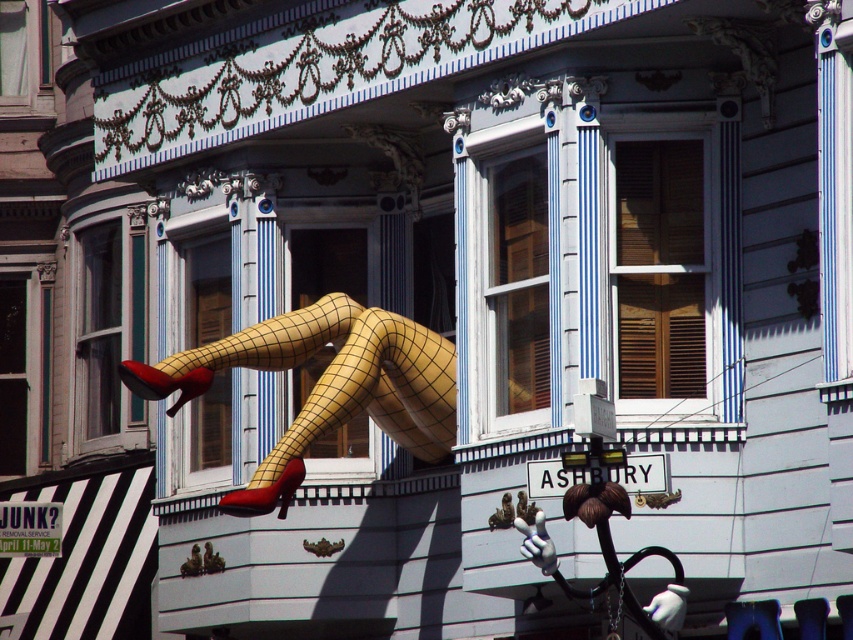
Question: Which point is farther to the camera?

Choices:
 (A) matte yellow shoe at center
 (B) yellow mesh legs at center

Answer: (A)

Question: From the image, what is the correct spatial relationship of yellow mesh legs at center in relation to matte yellow shoe at center?

Choices:
 (A) left
 (B) right

Answer: (B)

Question: Based on their relative distances, which object is nearer to the shiny red high-heeled shoe at left?

Choices:
 (A) yellow mesh legs at center
 (B) matte yellow shoe at center

Answer: (A)

Question: Is yellow mesh legs at center to the left of shiny red high-heeled shoe at left from the viewer's perspective?

Choices:
 (A) no
 (B) yes

Answer: (A)

Question: Is yellow mesh legs at center wider than shiny red high-heeled shoe at left?

Choices:
 (A) no
 (B) yes

Answer: (B)

Question: Which object appears farthest from the camera in this image?

Choices:
 (A) matte yellow shoe at center
 (B) shiny red high-heeled shoe at left
 (C) yellow mesh legs at center

Answer: (A)